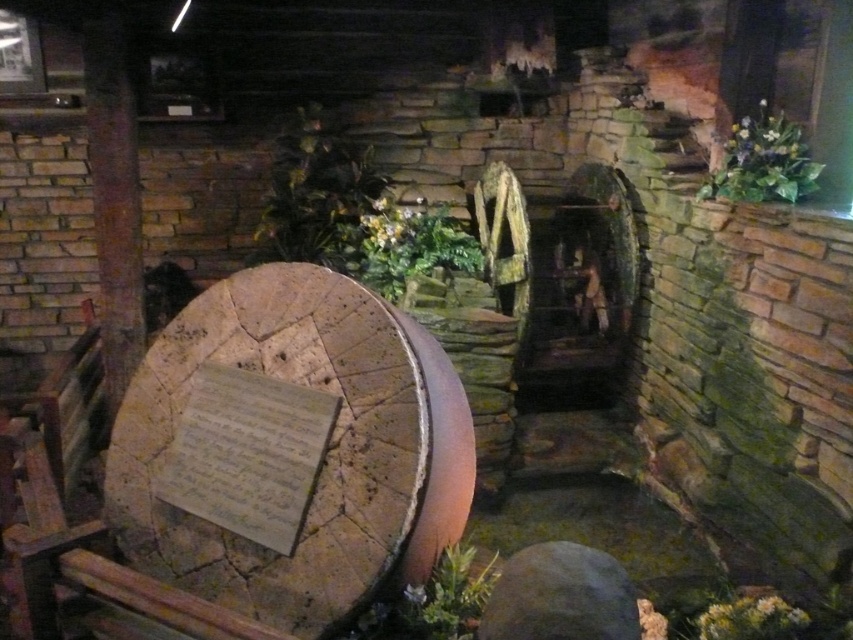
Does green leafy plant at upper center have a greater height compared to green leafy plant at upper right?

Indeed, green leafy plant at upper center has a greater height compared to green leafy plant at upper right.

Between green leafy plant at upper center and green leafy plant at upper right, which one has more height?

green leafy plant at upper center is taller.

Is point (331, 241) positioned in front of point (780, 189)?

That is False.

In order to click on green leafy plant at upper center in this screenshot , I will do `click(317, 195)`.

Consider the image. Can you confirm if green leafy plant at upper center is positioned below green leafy plant at center?

Actually, green leafy plant at upper center is above green leafy plant at center.

Does green leafy plant at upper center appear on the left side of green leafy plant at center?

Correct, you'll find green leafy plant at upper center to the left of green leafy plant at center.

Who is more distant from viewer, (321, 172) or (415, 209)?

The point (415, 209) is behind.

At what (x,y) coordinates should I click in order to perform the action: click on green leafy plant at upper center. Please return your answer as a coordinate pair (x, y). The height and width of the screenshot is (640, 853). Looking at the image, I should click on (317, 195).

Can you confirm if green leafy plant at upper right is positioned above green leafy plant at lower right?

Indeed, green leafy plant at upper right is positioned over green leafy plant at lower right.

This screenshot has height=640, width=853. What are the coordinates of `green leafy plant at upper right` in the screenshot? It's located at (763, 161).